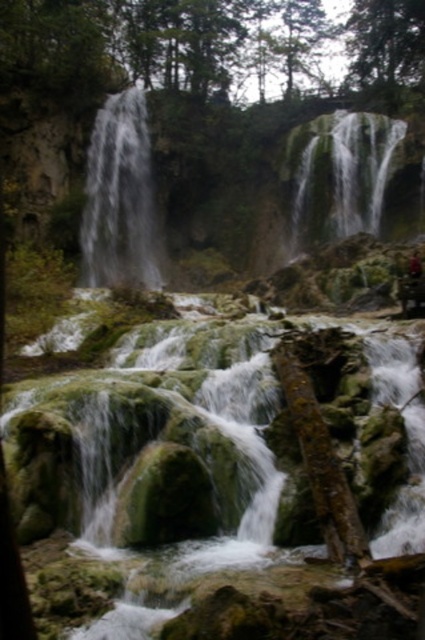
Question: Estimate the real-world distances between objects in this image. Which object is closer to the white frothy water at left?

Choices:
 (A) camouflage fabric hiker at center
 (B) green mossy rock at upper right

Answer: (B)

Question: Does white frothy water at left have a smaller size compared to camouflage fabric hiker at center?

Choices:
 (A) yes
 (B) no

Answer: (B)

Question: Which object is farther from the camera taking this photo?

Choices:
 (A) white frothy water at left
 (B) camouflage fabric hiker at center
 (C) green mossy rock at upper right

Answer: (A)

Question: Which object is farther from the camera taking this photo?

Choices:
 (A) green mossy rock at upper right
 (B) camouflage fabric hiker at center

Answer: (A)

Question: Can you confirm if white frothy water at left is thinner than camouflage fabric hiker at center?

Choices:
 (A) no
 (B) yes

Answer: (A)

Question: Observing the image, what is the correct spatial positioning of green mossy rock at upper right in reference to camouflage fabric hiker at center?

Choices:
 (A) left
 (B) right

Answer: (A)